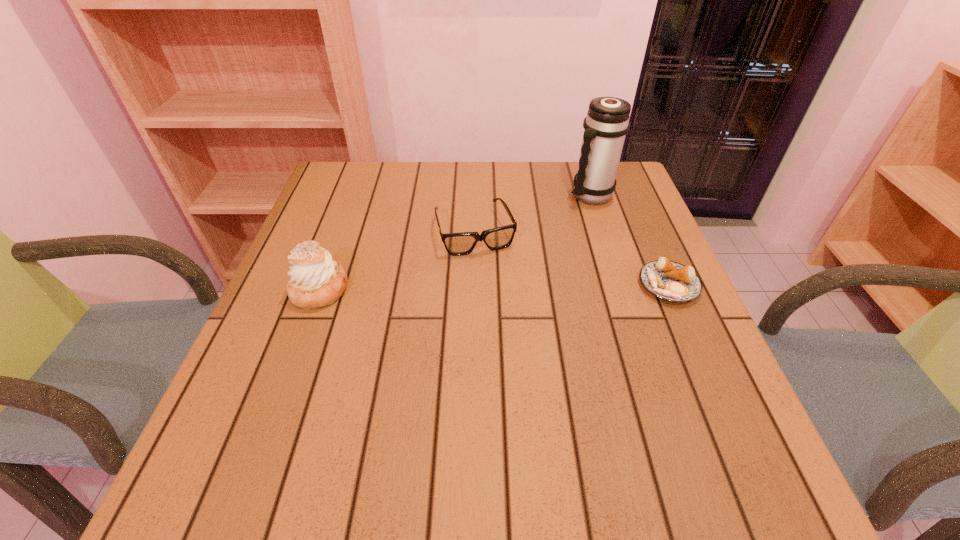
This screenshot has height=540, width=960. I want to click on free space located 0.320m on the front-facing side of the third nearest object, so click(x=524, y=367).

You are a GUI agent. You are given a task and a screenshot of the screen. Output one action in this format:
    pyautogui.click(x=<x>, y=<y>)
    Task: Click on the vacant region located on the front-facing side of the third nearest object
    
    Given the screenshot: What is the action you would take?
    pyautogui.click(x=536, y=399)

Image resolution: width=960 pixels, height=540 pixels. Find the location of `blank area located 0.290m on the front-facing side of the third nearest object`. blank area located 0.290m on the front-facing side of the third nearest object is located at coordinates (519, 354).

Locate an element on the screen. The height and width of the screenshot is (540, 960). vacant space situated 0.070m on the side with the handle of the tallest object is located at coordinates (567, 217).

The image size is (960, 540). Find the location of `blank space located 0.140m on the side with the handle of the tallest object`. blank space located 0.140m on the side with the handle of the tallest object is located at coordinates (554, 230).

Locate an element on the screen. Image resolution: width=960 pixels, height=540 pixels. free space located 0.270m on the side with the handle of the tallest object is located at coordinates (527, 258).

This screenshot has height=540, width=960. What are the coordinates of `object situated at the far edge` in the screenshot? It's located at (607, 122).

This screenshot has width=960, height=540. What are the coordinates of `object situated at the left edge` in the screenshot? It's located at (316, 280).

At what (x,y) coordinates should I click in order to perform the action: click on pastry that is positioned at the right edge. Please return your answer as a coordinate pair (x, y). Looking at the image, I should click on (667, 280).

What are the coordinates of `thermos bottle that is positioned at the right edge` in the screenshot? It's located at (607, 122).